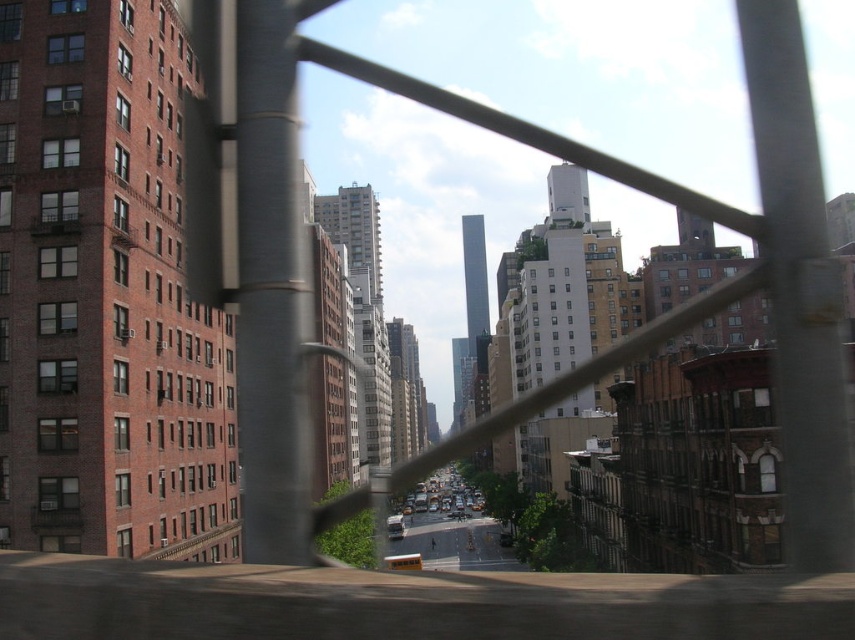
How far apart are metallic gray pole at right and smooth metallic pole at center?

A distance of 20.13 meters exists between metallic gray pole at right and smooth metallic pole at center.

Based on the photo, who is lower down, metallic gray pole at right or smooth metallic pole at center?

smooth metallic pole at center

Is point (840, 545) positioned after point (272, 368)?

No, (840, 545) is closer to viewer.

The height and width of the screenshot is (640, 855). Find the location of `metallic gray pole at right`. metallic gray pole at right is located at coordinates (799, 291).